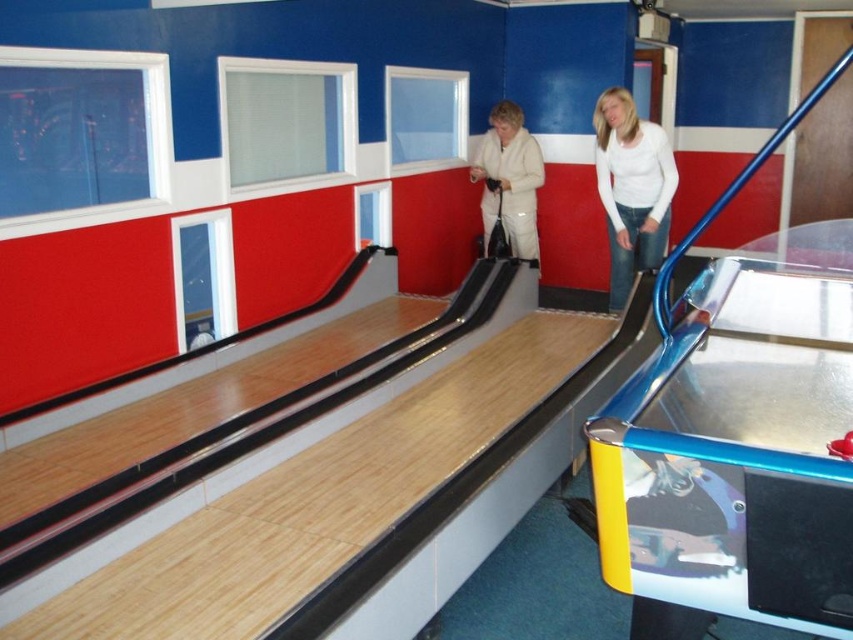
Question: Which point is farther to the camera?

Choices:
 (A) white fleece jacket at center
 (B) white matte shirt at upper right

Answer: (A)

Question: Is white matte shirt at upper right bigger than white fleece jacket at center?

Choices:
 (A) no
 (B) yes

Answer: (B)

Question: Does white matte shirt at upper right appear on the right side of white fleece jacket at center?

Choices:
 (A) no
 (B) yes

Answer: (B)

Question: Among these objects, which one is nearest to the camera?

Choices:
 (A) white fleece jacket at center
 (B) white matte shirt at upper right

Answer: (B)

Question: Is white matte shirt at upper right smaller than white fleece jacket at center?

Choices:
 (A) no
 (B) yes

Answer: (A)